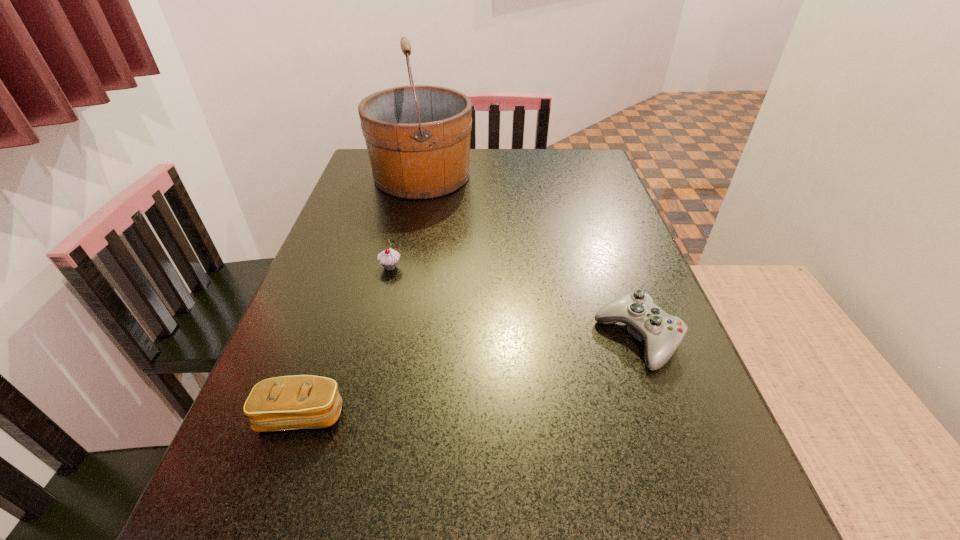
You are a GUI agent. You are given a task and a screenshot of the screen. Output one action in this format:
    pyautogui.click(x=<x>, y=<y>)
    Task: Click on the object that stands as the second closest to the farthest object
    
    Given the screenshot: What is the action you would take?
    pyautogui.click(x=662, y=333)

Identify which object is located as the second nearest to the clutch bag. Please provide its 2D coordinates. Your answer should be formatted as a tuple, i.e. [(x, y)], where the tuple contains the x and y coordinates of a point satisfying the conditions above.

[(662, 333)]

Locate an element on the screen. free region that satisfies the following two spatial constraints: 1. on the back side of the bucket; 2. on the right side of the cupcake is located at coordinates (412, 176).

You are a GUI agent. You are given a task and a screenshot of the screen. Output one action in this format:
    pyautogui.click(x=<x>, y=<y>)
    Task: Click on the free space that satisfies the following two spatial constraints: 1. on the back side of the bucket; 2. on the right side of the cupcake
    The height and width of the screenshot is (540, 960).
    Given the screenshot: What is the action you would take?
    pyautogui.click(x=412, y=176)

Locate an element on the screen. vacant space that satisfies the following two spatial constraints: 1. on the back side of the farthest object; 2. on the right side of the second farthest object is located at coordinates (412, 176).